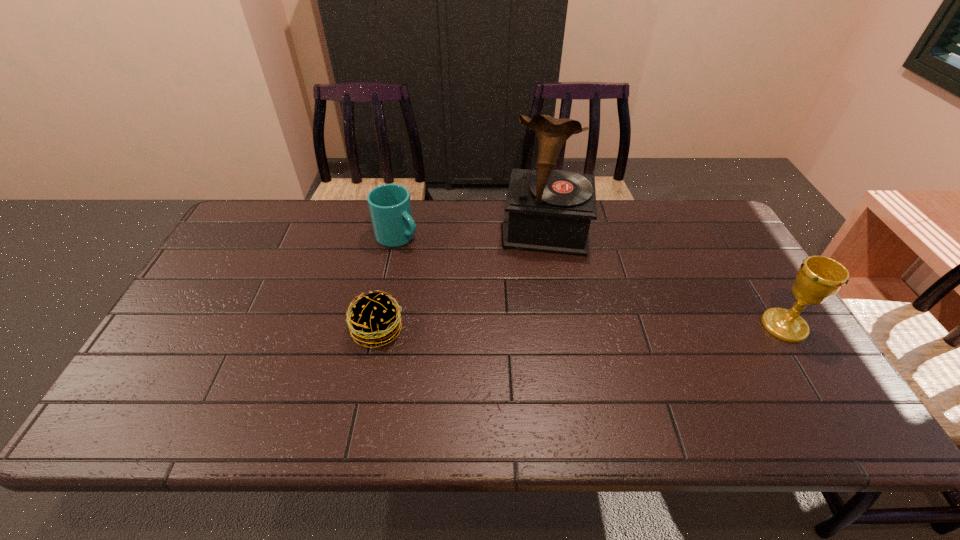
Image resolution: width=960 pixels, height=540 pixels. What are the coordinates of `free spot between the third object from left to right and the chalice` in the screenshot? It's located at (665, 279).

Where is `vacant area between the cup and the rightmost object`? vacant area between the cup and the rightmost object is located at coordinates (591, 281).

Locate an element on the screen. free space that is in between the chalice and the patty is located at coordinates (581, 328).

Locate an element on the screen. the second closest object to the second shortest object is located at coordinates (550, 211).

Locate an element on the screen. This screenshot has height=540, width=960. object that is the nearest to the cup is located at coordinates (373, 319).

Where is `free space that satisfies the following two spatial constraints: 1. on the front side of the phonograph_record; 2. on the right side of the rightmost object`? free space that satisfies the following two spatial constraints: 1. on the front side of the phonograph_record; 2. on the right side of the rightmost object is located at coordinates (563, 326).